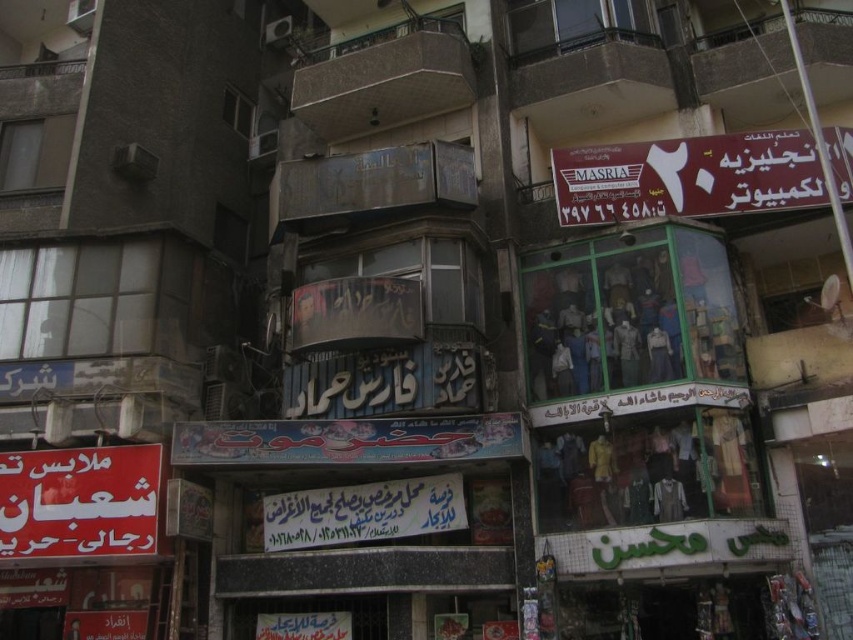
You are a delivery person trying to locate the correct address on this building. You see a maroon plastic signboard at upper right and a red fabric sign at lower left. Which sign is positioned higher up on the building?

The maroon plastic signboard at upper right is positioned higher up on the building than the red fabric sign at lower left.

You are a delivery drone operator. Your drone is currently positioned at the camera location. The maroon plastic signboard at upper right has a delivery address on it. Can your drone reach the signboard within 100 feet? Please answer based on the distance provided.

The maroon plastic signboard at upper right and the camera are 98.42 feet apart, so yes, the drone can reach the signboard within 100 feet since the distance is less than the limit.